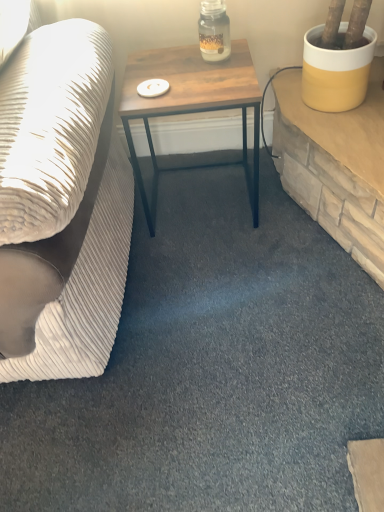
Question: Is point (200, 5) closer or farther from the camera than point (170, 62)?

Choices:
 (A) farther
 (B) closer

Answer: (A)

Question: Would you say translucent glass jar at center is inside or outside wooden table at center?

Choices:
 (A) inside
 (B) outside

Answer: (B)

Question: Estimate the real-world distances between objects in this image. Which object is closer to the translucent glass jar at center?

Choices:
 (A) wooden table at center
 (B) white textured fabric couch at left

Answer: (A)

Question: Considering the real-world distances, which object is farthest from the wooden table at center?

Choices:
 (A) translucent glass jar at center
 (B) white textured fabric couch at left

Answer: (B)